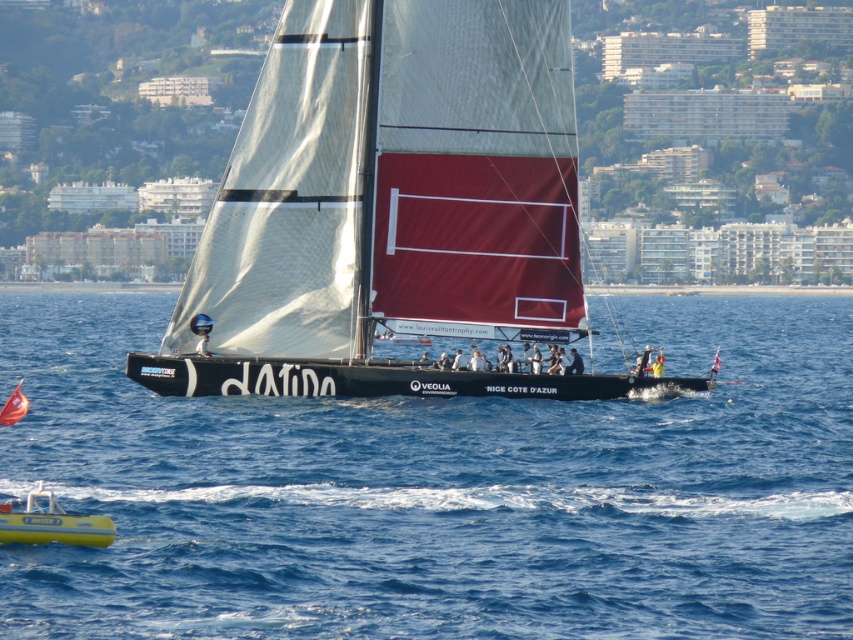
Is blue water at center shorter than yellow rubber dinghy at lower left?

Incorrect, blue water at center's height does not fall short of yellow rubber dinghy at lower left's.

Describe the element at coordinates (438, 490) in the screenshot. I see `blue water at center` at that location.

At what (x,y) coordinates should I click in order to perform the action: click on blue water at center. Please return your answer as a coordinate pair (x, y). Looking at the image, I should click on (438, 490).

Is blue water at center below white matte sail at center?

Yes.

Is blue water at center wider than white matte sail at center?

Yes.

Describe the element at coordinates (438, 490) in the screenshot. I see `blue water at center` at that location.

Identify the location of blue water at center. This screenshot has width=853, height=640. (438, 490).

Between white matte sail at center and yellow rubber dinghy at lower left, which one has less height?

yellow rubber dinghy at lower left

Does white matte sail at center have a lesser width compared to yellow rubber dinghy at lower left?

No, white matte sail at center is not thinner than yellow rubber dinghy at lower left.

Does point (433, 301) lie behind point (38, 524)?

Yes, point (433, 301) is behind point (38, 524).

Where is `white matte sail at center`? white matte sail at center is located at coordinates (392, 208).